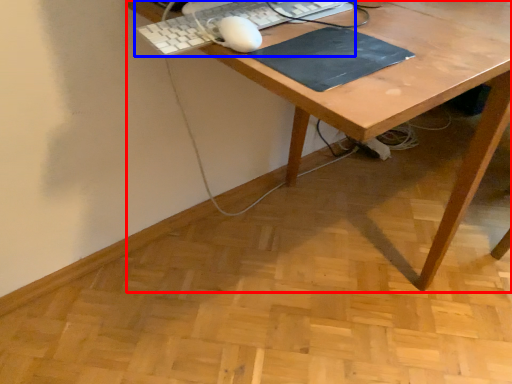
Question: Which object appears farthest to the camera in this image, desk (highlighted by a red box) or computer keyboard (highlighted by a blue box)?

Choices:
 (A) desk
 (B) computer keyboard

Answer: (B)